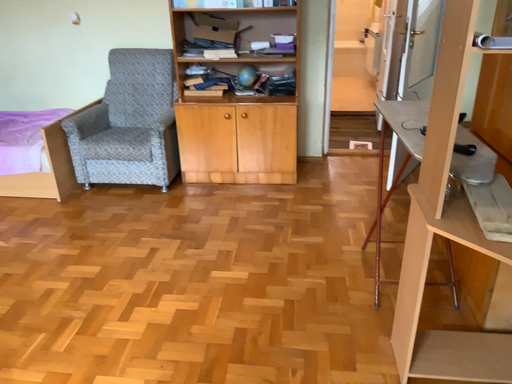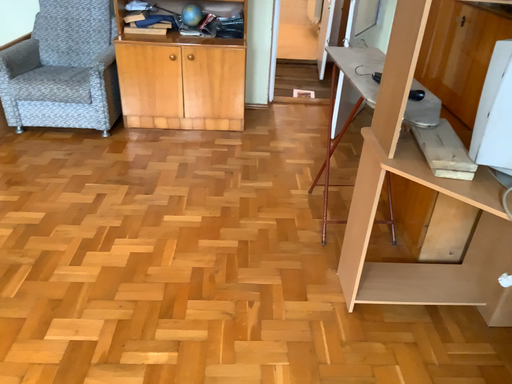
Question: How did the camera likely rotate when shooting the video?

Choices:
 (A) rotated downward
 (B) rotated upward

Answer: (A)